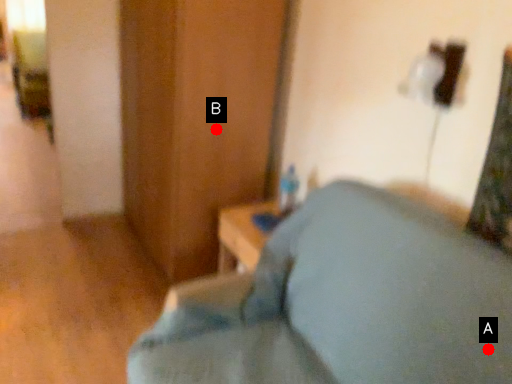
Question: Two points are circled on the image, labeled by A and B beside each circle. Which point is farther from the camera taking this photo?

Choices:
 (A) A is further
 (B) B is further

Answer: (B)